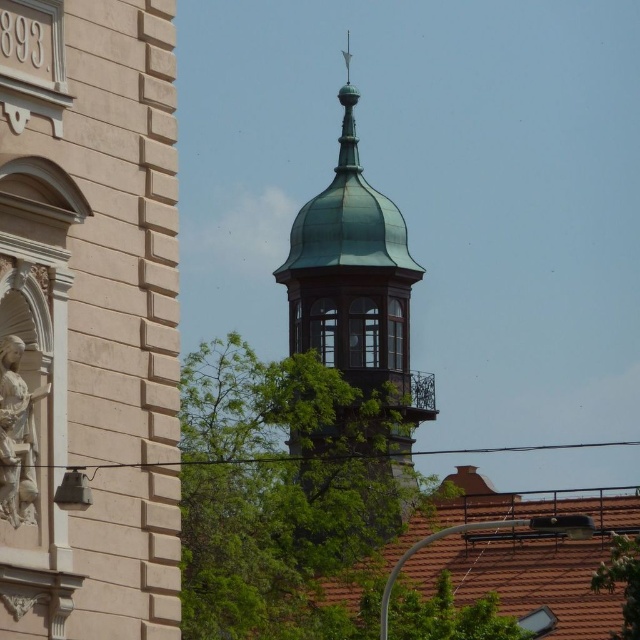
Question: Which point is farther from the camera taking this photo?

Choices:
 (A) (144, 278)
 (B) (29, 467)
 (C) (404, 420)

Answer: (C)

Question: Where is matte beige church at left located in relation to white marble statue at left in the image?

Choices:
 (A) right
 (B) left

Answer: (A)

Question: Can you confirm if green copper dome at upper center is positioned to the right of white marble statue at left?

Choices:
 (A) no
 (B) yes

Answer: (B)

Question: Which object is positioned farthest from the white marble statue at left?

Choices:
 (A) green copper dome at upper center
 (B) matte beige church at left

Answer: (A)

Question: Which object is positioned farthest from the white marble statue at left?

Choices:
 (A) green copper dome at upper center
 (B) matte beige church at left

Answer: (A)

Question: Can you confirm if matte beige church at left is positioned below white marble statue at left?

Choices:
 (A) no
 (B) yes

Answer: (A)